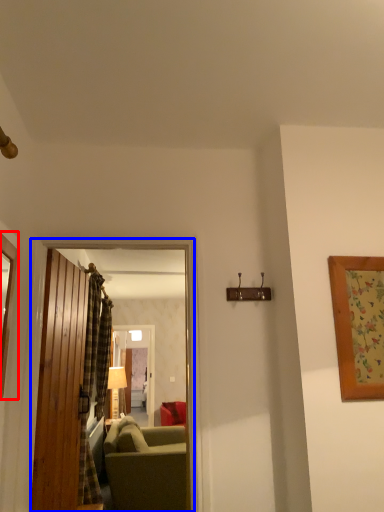
Question: Which object is further to the camera taking this photo, picture frame (highlighted by a red box) or door (highlighted by a blue box)?

Choices:
 (A) picture frame
 (B) door

Answer: (B)